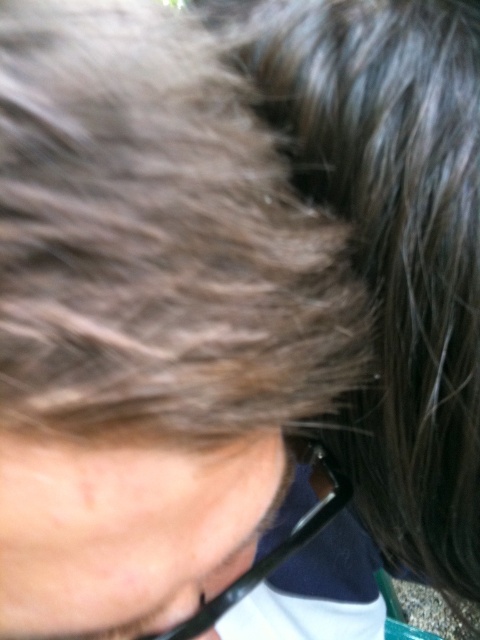
Question: Does dark brown hair at upper right have a larger size compared to black plastic glasses at lower center?

Choices:
 (A) yes
 (B) no

Answer: (A)

Question: Does dark brown hair at upper right appear on the right side of black plastic glasses at lower center?

Choices:
 (A) yes
 (B) no

Answer: (A)

Question: Which point is closer to the camera?

Choices:
 (A) dark brown hair at upper right
 (B) black plastic glasses at lower center

Answer: (B)

Question: Does dark brown hair at upper right appear on the left side of black plastic glasses at lower center?

Choices:
 (A) no
 (B) yes

Answer: (A)

Question: Which point is closer to the camera taking this photo?

Choices:
 (A) [x=50, y=566]
 (B) [x=446, y=561]

Answer: (A)

Question: Among these objects, which one is farthest from the camera?

Choices:
 (A) black plastic glasses at lower center
 (B) dark brown hair at upper right

Answer: (B)